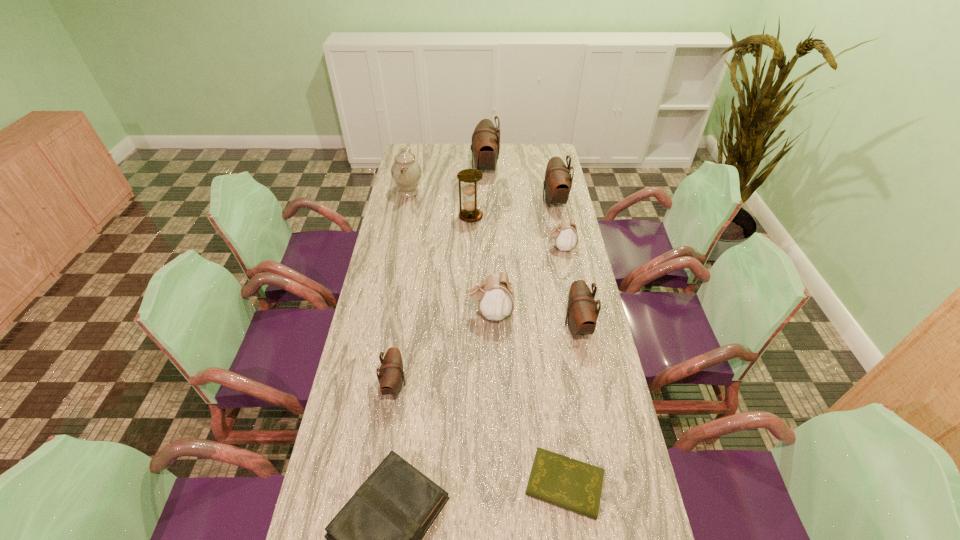
The image size is (960, 540). I want to click on vacant space situated 0.050m on the front-facing side of the farther white pouch, so click(x=533, y=247).

Identify the location of free space located on the front-facing side of the farther white pouch. This screenshot has width=960, height=540. (458, 247).

Locate an element on the screen. The height and width of the screenshot is (540, 960). blank space located 0.250m with the flap open on the leftmost brown pouch is located at coordinates (490, 384).

Identify the location of blank space located on the back of the diary. (549, 366).

Locate an element on the screen. object that is at the far edge is located at coordinates (485, 147).

Identify the location of chinaware that is positioned at the left edge. pyautogui.click(x=406, y=171).

Locate an element on the screen. Image resolution: width=960 pixels, height=540 pixels. pouch positioned at the left edge is located at coordinates (391, 375).

At what (x,y) coordinates should I click in order to perform the action: click on diary at the right edge. Please return your answer as a coordinate pair (x, y). Image resolution: width=960 pixels, height=540 pixels. Looking at the image, I should click on (574, 485).

Identify the location of free space at the left edge. Image resolution: width=960 pixels, height=540 pixels. (359, 341).

At what (x,y) coordinates should I click in order to perform the action: click on free region at the right edge. Please return your answer as a coordinate pair (x, y). The image size is (960, 540). Looking at the image, I should click on (581, 250).